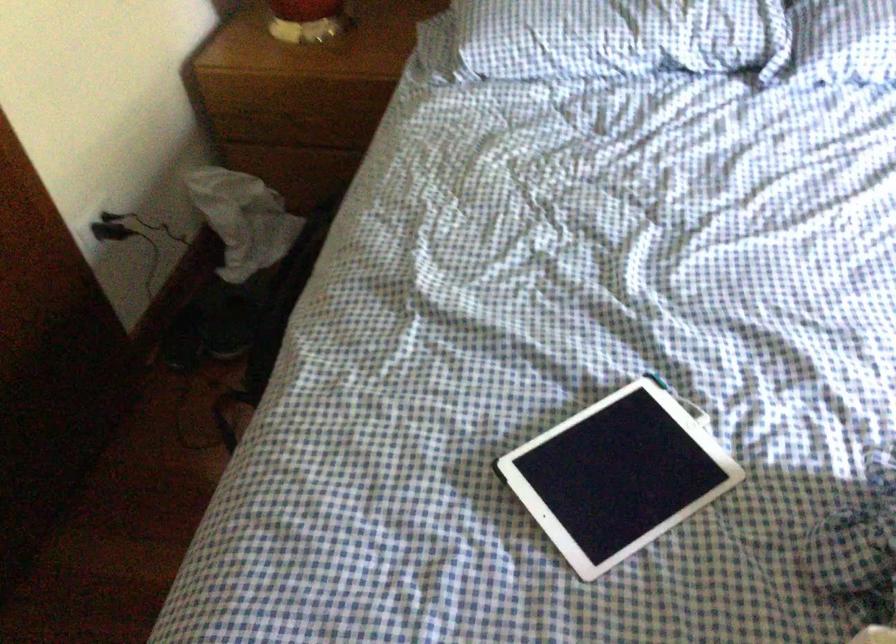
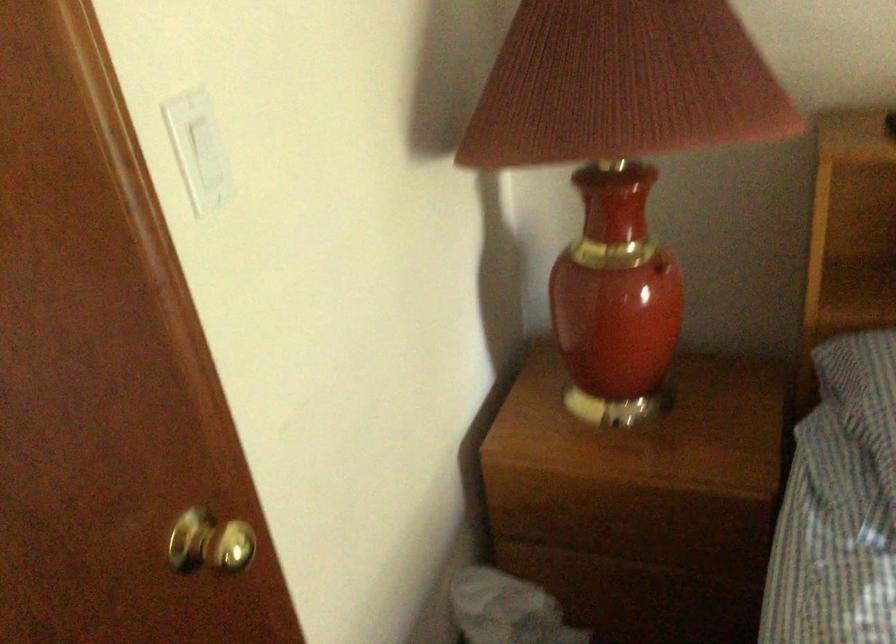
Question: How did the camera likely rotate?

Choices:
 (A) Left
 (B) Right
 (C) Up
 (D) Down

Answer: (C)